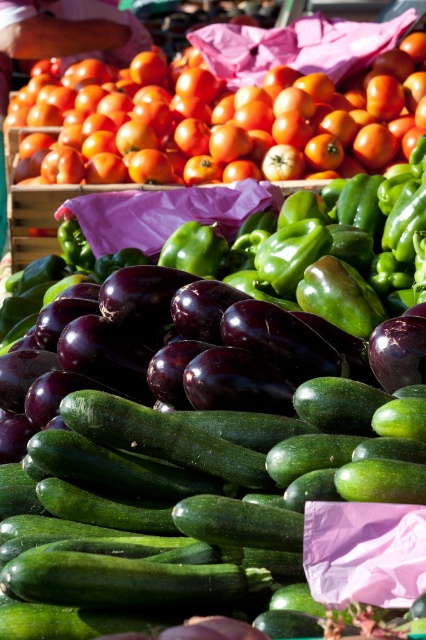
Question: Is green smooth cucumber at center bigger than shiny orange tomato at upper left?

Choices:
 (A) no
 (B) yes

Answer: (A)

Question: Which of the following is the farthest from the observer?

Choices:
 (A) green smooth cucumber at center
 (B) shiny orange tomato at upper left

Answer: (B)

Question: Does green smooth cucumber at center have a smaller size compared to shiny orange tomato at upper left?

Choices:
 (A) no
 (B) yes

Answer: (B)

Question: Does green smooth cucumber at center have a lesser width compared to shiny orange tomato at upper left?

Choices:
 (A) no
 (B) yes

Answer: (B)